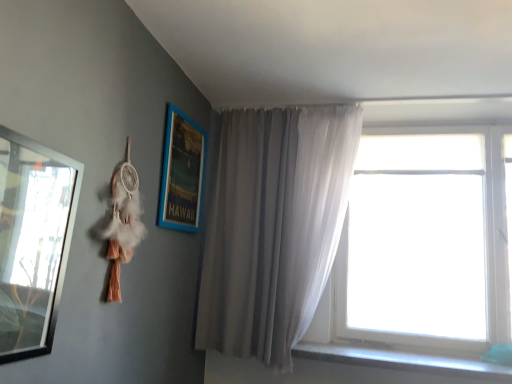
Question: Are blue wooden picture frame at upper left, the second picture frame viewed from the front, and transparent glass window at right making contact?

Choices:
 (A) no
 (B) yes

Answer: (A)

Question: Is blue wooden picture frame at upper left, the second picture frame viewed from the front, oriented away from transparent glass window at right?

Choices:
 (A) no
 (B) yes

Answer: (A)

Question: Can you confirm if blue wooden picture frame at upper left, which is the second picture frame in left-to-right order, is shorter than transparent glass window at right?

Choices:
 (A) yes
 (B) no

Answer: (A)

Question: Can you confirm if blue wooden picture frame at upper left, which is the second picture frame in left-to-right order, is smaller than transparent glass window at right?

Choices:
 (A) no
 (B) yes

Answer: (B)

Question: Is the position of blue wooden picture frame at upper left, which is the second picture frame in left-to-right order, more distant than that of transparent glass window at right?

Choices:
 (A) no
 (B) yes

Answer: (A)

Question: From the image's perspective, is blue wooden picture frame at upper left, the second picture frame viewed from the front, on transparent glass window at right?

Choices:
 (A) no
 (B) yes

Answer: (B)

Question: Does transparent glass window at right have a lesser height compared to blue wooden picture frame at upper left, which is the second picture frame in left-to-right order?

Choices:
 (A) yes
 (B) no

Answer: (B)

Question: Is transparent glass window at right smaller than blue wooden picture frame at upper left, the second picture frame viewed from the front?

Choices:
 (A) no
 (B) yes

Answer: (A)

Question: Is transparent glass window at right at the left side of blue wooden picture frame at upper left, which is the second picture frame in left-to-right order?

Choices:
 (A) no
 (B) yes

Answer: (A)

Question: Does transparent glass window at right come behind blue wooden picture frame at upper left, the second picture frame viewed from the front?

Choices:
 (A) yes
 (B) no

Answer: (A)

Question: Could you tell me if transparent glass window at right is facing blue wooden picture frame at upper left, which is the first picture frame from right to left?

Choices:
 (A) no
 (B) yes

Answer: (A)

Question: Would you say transparent glass window at right contains blue wooden picture frame at upper left, which is the first picture frame from right to left?

Choices:
 (A) yes
 (B) no

Answer: (B)

Question: Is gray fabric curtain at center at the right side of blue wooden picture frame at upper left, the second picture frame viewed from the front?

Choices:
 (A) no
 (B) yes

Answer: (B)